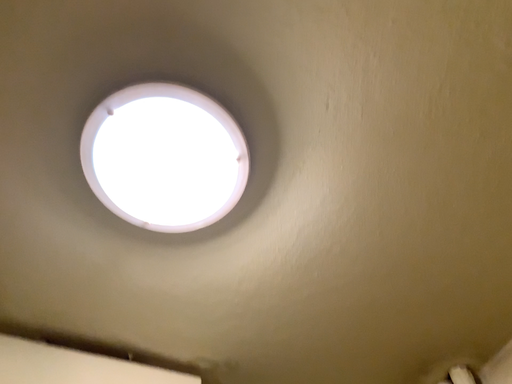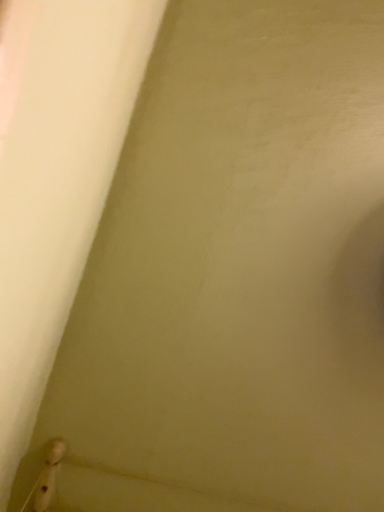
Question: How did the camera likely rotate when shooting the video?

Choices:
 (A) rotated left
 (B) rotated right

Answer: (A)